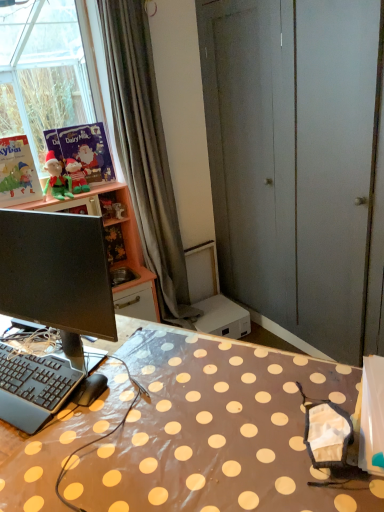
Identify the location of vacant space to the right of black rubberized computer mouse at lower left. (147, 386).